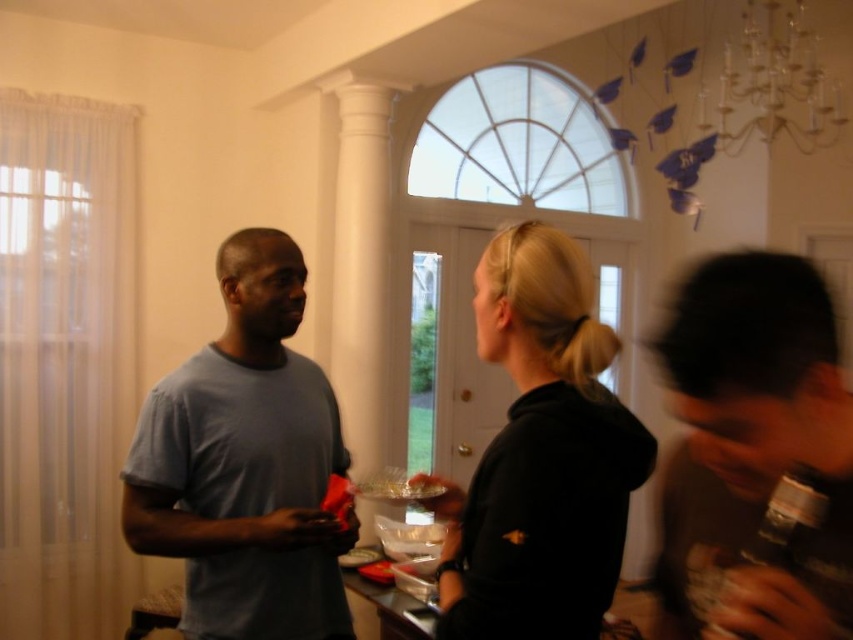
You are a photographer setting up for an event in this room. You need to position a camera on a tripod that requires a minimum width of 30 cm to avoid obstruction. Given the dark gray matte shirt at right and the metallic glass chandelier at upper right, which object might pose a problem if placed too close to the camera?

The metallic glass chandelier at upper right is wider than the dark gray matte shirt at right, so placing the camera near the metallic glass chandelier at upper right might block the view if it is wider than 30 cm. Check the actual width of the chandelier to ensure it doesn

You are a photographer setting up for an event in the room described. You need to ensure that the dark gray matte shirt at right and the metallic glass chandelier at upper right are both visible in your shot. Given their heights, which object will appear larger in the photo?

The metallic glass chandelier at upper right will appear larger in the photo because it is taller than the dark gray matte shirt at right.

You are organizing a small party in this room and need to place a large decorative item. You have two options from the scene, the black matte hoodie at center and the metallic glass chandelier at upper right. Which object should you choose for the decorative item if you want something that takes up more space?

The metallic glass chandelier at upper right should be chosen because it occupies more space than the black matte hoodie at center.